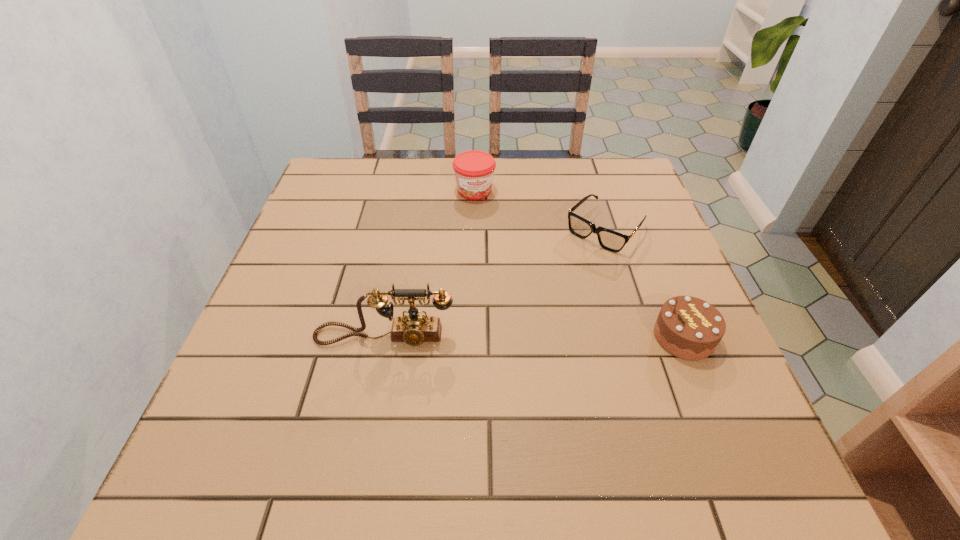
Image resolution: width=960 pixels, height=540 pixels. I want to click on free space located on the front-facing side of the sunglasses, so click(x=555, y=282).

I want to click on free spot located on the front-facing side of the sunglasses, so pos(515,326).

Locate an element on the screen. The width and height of the screenshot is (960, 540). vacant area situated on the front-facing side of the sunglasses is located at coordinates (503, 339).

You are a GUI agent. You are given a task and a screenshot of the screen. Output one action in this format:
    pyautogui.click(x=<x>, y=<y>)
    Task: Click on the object located at the far edge
    This screenshot has width=960, height=540.
    Given the screenshot: What is the action you would take?
    pyautogui.click(x=474, y=170)

The height and width of the screenshot is (540, 960). I want to click on object present at the left edge, so click(x=414, y=328).

Locate an element on the screen. The height and width of the screenshot is (540, 960). chocolate cake at the right edge is located at coordinates point(687,327).

You are a GUI agent. You are given a task and a screenshot of the screen. Output one action in this format:
    pyautogui.click(x=<x>, y=<y>)
    Task: Click on the sunglasses at the right edge
    This screenshot has width=960, height=540.
    Given the screenshot: What is the action you would take?
    pyautogui.click(x=613, y=241)

The width and height of the screenshot is (960, 540). I want to click on vacant area at the far edge, so click(562, 169).

At what (x,y) coordinates should I click in order to perform the action: click on free space at the near edge of the desktop. Please return your answer as a coordinate pair (x, y). Image resolution: width=960 pixels, height=540 pixels. Looking at the image, I should click on (338, 396).

You are a GUI agent. You are given a task and a screenshot of the screen. Output one action in this format:
    pyautogui.click(x=<x>, y=<y>)
    Task: Click on the vacant space at the left edge of the desktop
    Image resolution: width=960 pixels, height=540 pixels.
    Given the screenshot: What is the action you would take?
    [x=276, y=326]